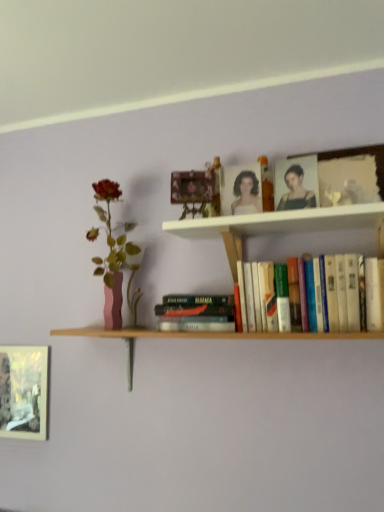
Describe the element at coordinates (296, 191) in the screenshot. I see `matte black portrait at upper center` at that location.

What do you see at coordinates (274, 225) in the screenshot?
I see `white wooden shelf at upper center` at bounding box center [274, 225].

Where is `hardcover books at center, the first book from the right`? The image size is (384, 512). hardcover books at center, the first book from the right is located at coordinates (342, 293).

Which is correct: matte black portrait at upper center is inside hardcover book at center, acting as the 1th book starting from the left, or outside of it?

matte black portrait at upper center is spatially situated outside hardcover book at center, acting as the 1th book starting from the left.

Could you tell me if matte black portrait at upper center is facing hardcover book at center, acting as the 1th book starting from the left?

No, matte black portrait at upper center is not facing towards hardcover book at center, acting as the 1th book starting from the left.

Is point (313, 202) behind point (228, 301)?

No.

Are matte pink vase at left and hardcover book at center, the second book in the right-to-left sequence, beside each other?

They are not placed beside each other.

From a real-world perspective, who is located higher, matte pink vase at left or hardcover book at center, acting as the 1th book starting from the left?

In real-world perspective, matte pink vase at left is above.

Which object is positioned more to the left, matte pink vase at left or hardcover book at center, the second book in the right-to-left sequence?

matte pink vase at left is more to the left.

Would you say matte pink vase at left contains hardcover book at center, the second book in the right-to-left sequence?

No, hardcover book at center, the second book in the right-to-left sequence, is located outside of matte pink vase at left.

Does matte pink vase at left appear on the left side of hardcover books at center, the first book from the right?

Yes.

Considering the relative sizes of matte pink vase at left and hardcover books at center, the first book from the right, in the image provided, is matte pink vase at left thinner than hardcover books at center, the first book from the right,?

Correct, the width of matte pink vase at left is less than that of hardcover books at center, the first book from the right.

From the image's perspective, relative to hardcover books at center, the second book in the left-to-right sequence, is matte pink vase at left above or below?

matte pink vase at left is situated higher than hardcover books at center, the second book in the left-to-right sequence, in the image.

Based on their sizes in the image, would you say matte pink vase at left is bigger or smaller than hardcover books at center, the first book from the right?

In the image, matte pink vase at left appears to be smaller than hardcover books at center, the first book from the right.

Is metallic silver frame at lower left, which is counted as the 2th picture frame, starting from the right, in front of or behind hardcover books at center, the first book from the right, in the image?

In the image, metallic silver frame at lower left, which is counted as the 2th picture frame, starting from the right, appears behind hardcover books at center, the first book from the right.

Can you tell me how much metallic silver frame at lower left, which is counted as the 2th picture frame, starting from the front, and hardcover books at center, the second book in the left-to-right sequence, differ in facing direction?

0.00702 degrees.

Considering the points (12, 387) and (338, 288), which point is behind, point (12, 387) or point (338, 288)?

The point (12, 387) is more distant.

Find the location of a particular element. This screenshot has height=512, width=384. book located underneath the hardcover books at center, the first book from the right (from a real-world perspective) is located at coordinates (196, 313).

Considering the sizes of objects hardcover books at center, the first book from the right, and hardcover book at center, the second book in the right-to-left sequence, in the image provided, who is taller, hardcover books at center, the first book from the right, or hardcover book at center, the second book in the right-to-left sequence,?

Standing taller between the two is hardcover books at center, the first book from the right.

From the image's perspective, is hardcover books at center, the first book from the right, on hardcover book at center, acting as the 1th book starting from the left?

Yes, from the image's perspective, hardcover books at center, the first book from the right, is above hardcover book at center, acting as the 1th book starting from the left.

In the scene shown: Considering the sizes of objects white wooden shelf at upper center and metallic silver frame at lower left, the first picture frame from the left, in the image provided, who is shorter, white wooden shelf at upper center or metallic silver frame at lower left, the first picture frame from the left,?

white wooden shelf at upper center is shorter.

Which picture frame is the 2nd one when counting from the left side of the white wooden shelf at upper center? Please provide its 2D coordinates.

[(24, 392)]

From the image's perspective, which one is positioned lower, white wooden shelf at upper center or metallic silver frame at lower left, which is the 1th picture frame from bottom to top?

metallic silver frame at lower left, which is the 1th picture frame from bottom to top, appears lower in the image.

Can you confirm if hardcover books at center, the first book from the right, is thinner than white wooden shelf at upper center?

Yes, hardcover books at center, the first book from the right, is thinner than white wooden shelf at upper center.

From a real-world perspective, which object stands above the other?

In real-world perspective, white wooden shelf at upper center is above.

Looking at this image, can you tell me how much hardcover books at center, the second book in the left-to-right sequence, and white wooden shelf at upper center differ in facing direction?

The angle between the facing direction of hardcover books at center, the second book in the left-to-right sequence, and the facing direction of white wooden shelf at upper center is 0.000357 degrees.

Locate an element on the screen. The height and width of the screenshot is (512, 384). book located on the right of white wooden shelf at upper center is located at coordinates [x=342, y=293].

From the image's perspective, which book is the 2nd one below the matte black portrait at upper center? Please provide its 2D coordinates.

[(196, 313)]

The image size is (384, 512). Find the location of `the 1st book in front of the matte pink vase at left`. the 1st book in front of the matte pink vase at left is located at coordinates (196, 313).

Estimate the real-world distances between objects in this image. Which object is closer to metallic silver frame at lower left, arranged as the second picture frame when viewed from the top, matte black portrait at upper center or white wooden shelf at upper center?

white wooden shelf at upper center lies closer to metallic silver frame at lower left, arranged as the second picture frame when viewed from the top, than the other object.

In the scene shown: Looking at the image, which one is located closer to hardcover book at center, acting as the 1th book starting from the left, metallic silver frame at lower left, which is counted as the 2th picture frame, starting from the front, or hardcover books at center, the second book in the left-to-right sequence?

Based on the image, hardcover books at center, the second book in the left-to-right sequence, appears to be nearer to hardcover book at center, acting as the 1th book starting from the left.

Estimate the real-world distances between objects in this image. Which object is further from matte pink vase at left, metallic silver frame at lower left, arranged as the second picture frame when viewed from the top, or metallic gold picture frame at upper center, the second picture frame from the bottom?

Based on the image, metallic silver frame at lower left, arranged as the second picture frame when viewed from the top, appears to be further to matte pink vase at left.

Estimate the real-world distances between objects in this image. Which object is further from metallic silver frame at lower left, which is counted as the 2th picture frame, starting from the right, white wooden shelf at upper center or hardcover books at center, the first book from the right?

hardcover books at center, the first book from the right, is further to metallic silver frame at lower left, which is counted as the 2th picture frame, starting from the right.

Looking at the image, which one is located closer to white wooden shelf at upper center, metallic gold picture frame at upper center, which is the first picture frame from top to bottom, or matte black portrait at upper center?

Based on the image, matte black portrait at upper center appears to be nearer to white wooden shelf at upper center.

Based on their spatial positions, is metallic gold picture frame at upper center, the second picture frame from the bottom, or white wooden shelf at upper center further from hardcover book at center, the second book in the right-to-left sequence?

metallic gold picture frame at upper center, the second picture frame from the bottom, lies further to hardcover book at center, the second book in the right-to-left sequence, than the other object.

Looking at the image, which one is located further to matte black portrait at upper center, matte pink vase at left or metallic silver frame at lower left, the first picture frame from the left?

Based on the image, metallic silver frame at lower left, the first picture frame from the left, appears to be further to matte black portrait at upper center.

Considering their positions, is metallic gold picture frame at upper center, the 1th picture frame viewed from the front, positioned closer to metallic silver frame at lower left, which is the 1th picture frame from bottom to top, than hardcover books at center, the first book from the right?

metallic gold picture frame at upper center, the 1th picture frame viewed from the front, is positioned closer to the anchor metallic silver frame at lower left, which is the 1th picture frame from bottom to top.

At what (x,y) coordinates should I click in order to perform the action: click on flower between metallic silver frame at lower left, which is counted as the 2th picture frame, starting from the right, and matte black portrait at upper center. Please return your answer as a coordinate pair (x, y). Looking at the image, I should click on (111, 234).

At what (x,y) coordinates should I click in order to perform the action: click on picture frame between matte pink vase at left and white wooden shelf at upper center in the horizontal direction. Please return your answer as a coordinate pair (x, y). Image resolution: width=384 pixels, height=512 pixels. Looking at the image, I should click on (192, 186).

I want to click on picture frame between matte pink vase at left and hardcover books at center, the first book from the right, from left to right, so click(x=192, y=186).

Locate an element on the screen. The width and height of the screenshot is (384, 512). flower between metallic gold picture frame at upper center, which is the first picture frame from top to bottom, and hardcover book at center, acting as the 1th book starting from the left, in the vertical direction is located at coordinates (111, 234).